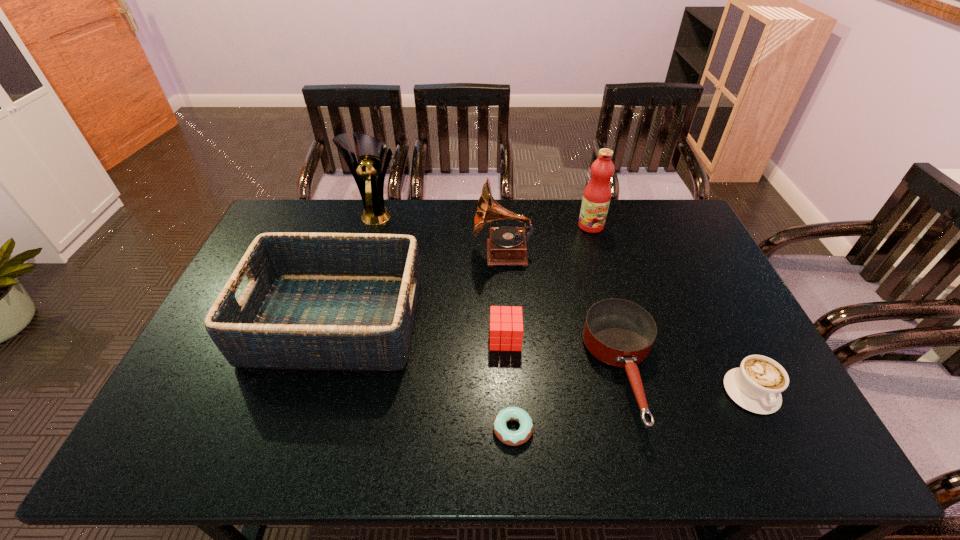
Find the location of a particular element. free region located on the horn of the phonograph_record is located at coordinates (442, 253).

You are a GUI agent. You are given a task and a screenshot of the screen. Output one action in this format:
    pyautogui.click(x=<x>, y=<y>)
    Task: Click on the vacant space situated on the horn of the phonograph_record
    This screenshot has height=540, width=960.
    Given the screenshot: What is the action you would take?
    pyautogui.click(x=368, y=253)

Find the location of `vacant space located 0.250m on the horn of the phonograph_record`. vacant space located 0.250m on the horn of the phonograph_record is located at coordinates (400, 253).

Locate an element on the screen. The height and width of the screenshot is (540, 960). blank area located 0.050m on the right of the basket is located at coordinates (436, 320).

Identify the location of free space located on the left of the cube. This screenshot has width=960, height=540. (411, 339).

Identify the location of vacant space located to the right of the cappuccino's handle. The height and width of the screenshot is (540, 960). (775, 438).

Find the location of a particular element. free region located on the back of the doughnut is located at coordinates (508, 339).

This screenshot has height=540, width=960. I want to click on award at the far edge, so click(367, 172).

You are a GUI agent. You are given a task and a screenshot of the screen. Output one action in this format:
    pyautogui.click(x=<x>, y=<y>)
    Task: Click on the fruit juice at the far edge
    This screenshot has width=960, height=540.
    Given the screenshot: What is the action you would take?
    click(x=596, y=198)

I want to click on phonograph_record that is at the far edge, so click(x=507, y=245).